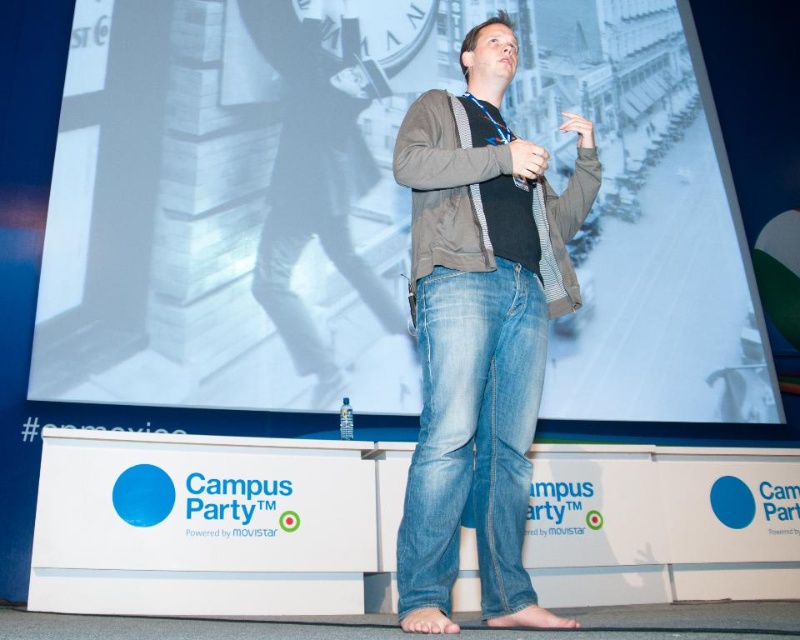
You are an event organizer setting up the stage for a presentation. You need to place a new projector that will project onto the white matte projection screen at upper center located at point (x=374, y=208). Where should you position the projector relative to the speaker and the backdrop?

The white matte projection screen at upper center is located at point (x=374, y=208) on the backdrop. To project onto it, the projector should be placed in front of the speaker and facing the backdrop, ensuring it is aligned with the screen coordinates.

You are sitting in the audience at the Campus Party event and want to know which of the two points, point (280, 364) or point (562, 268), is closer to you. Can you determine this based on their positions?

Point (280, 364) is closer to you than point (562, 268) because it is further to the viewer.